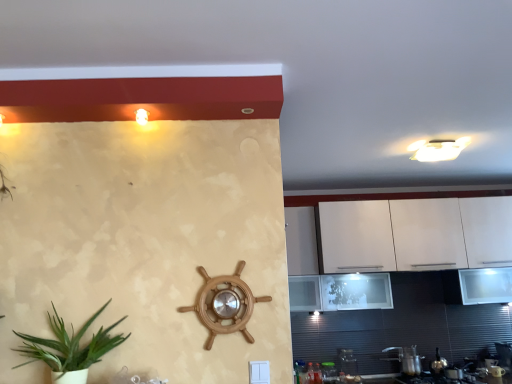
Question: Is metallic silver gas stove at lower right not close to white glossy cabinet at right?

Choices:
 (A) no
 (B) yes

Answer: (A)

Question: Does metallic silver gas stove at lower right have a smaller size compared to white glossy cabinet at right?

Choices:
 (A) yes
 (B) no

Answer: (A)

Question: Is metallic silver gas stove at lower right shorter than white glossy cabinet at right?

Choices:
 (A) no
 (B) yes

Answer: (B)

Question: Is metallic silver gas stove at lower right facing away from white glossy cabinet at right?

Choices:
 (A) yes
 (B) no

Answer: (B)

Question: From a real-world perspective, is metallic silver gas stove at lower right positioned over white glossy cabinet at right based on gravity?

Choices:
 (A) yes
 (B) no

Answer: (B)

Question: Could you tell me if metallic silver gas stove at lower right is facing white glossy cabinet at right?

Choices:
 (A) no
 (B) yes

Answer: (A)

Question: Is transparent glass jar at lower right, the third appliance when ordered from right to left, facing towards metallic silver gas stove at lower right?

Choices:
 (A) yes
 (B) no

Answer: (B)

Question: From the image's perspective, is transparent glass jar at lower right, which is the 1th appliance in left-to-right order, below metallic silver gas stove at lower right?

Choices:
 (A) no
 (B) yes

Answer: (A)

Question: Considering the relative sizes of transparent glass jar at lower right, which is the 1th appliance in left-to-right order, and metallic silver gas stove at lower right in the image provided, is transparent glass jar at lower right, which is the 1th appliance in left-to-right order, shorter than metallic silver gas stove at lower right?

Choices:
 (A) no
 (B) yes

Answer: (A)

Question: Considering the relative sizes of transparent glass jar at lower right, which is the 1th appliance in left-to-right order, and metallic silver gas stove at lower right in the image provided, is transparent glass jar at lower right, which is the 1th appliance in left-to-right order, bigger than metallic silver gas stove at lower right?

Choices:
 (A) no
 (B) yes

Answer: (A)

Question: Is transparent glass jar at lower right, which is the 1th appliance in left-to-right order, oriented away from metallic silver gas stove at lower right?

Choices:
 (A) no
 (B) yes

Answer: (A)

Question: Can you confirm if transparent glass jar at lower right, the third appliance when ordered from right to left, is positioned to the left of metallic silver gas stove at lower right?

Choices:
 (A) no
 (B) yes

Answer: (B)

Question: Is transparent glass jar at lower right, the third appliance when ordered from right to left, a part of metallic silver gas stove at lower right?

Choices:
 (A) no
 (B) yes

Answer: (A)